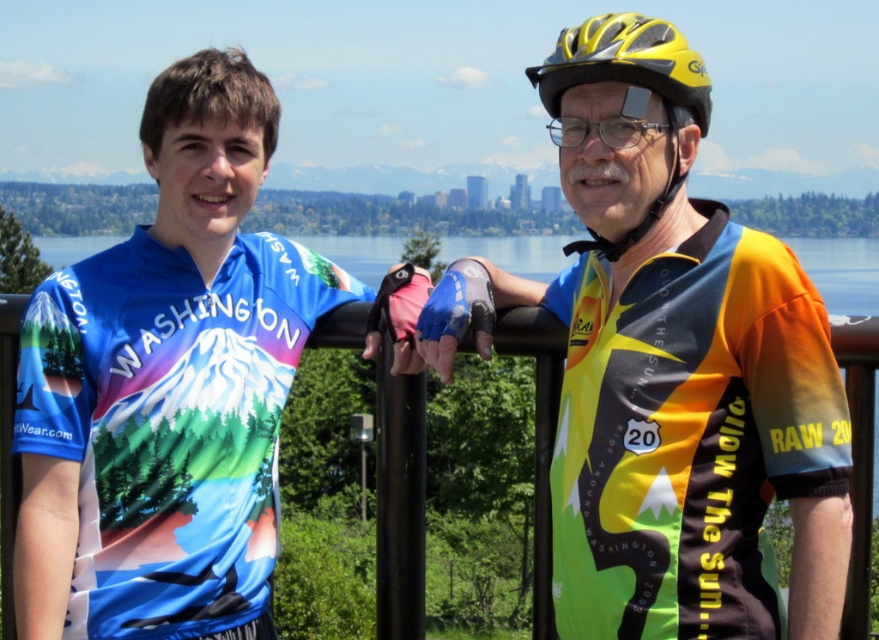
Is neon yellow jersey at center closer to camera compared to transparent plastic goggles at upper center?

Yes, neon yellow jersey at center is closer to the viewer.

Does neon yellow jersey at center appear on the right side of transparent plastic goggles at upper center?

In fact, neon yellow jersey at center is to the left of transparent plastic goggles at upper center.

Locate an element on the screen. neon yellow jersey at center is located at coordinates (672, 372).

Can you confirm if neon yellow jersey at center is smaller than yellow matte bicycle helmet at upper center?

Indeed, neon yellow jersey at center has a smaller size compared to yellow matte bicycle helmet at upper center.

Can you confirm if neon yellow jersey at center is bigger than yellow matte bicycle helmet at upper center?

No.

Who is more distant from viewer, (x=781, y=273) or (x=563, y=67)?

Point (x=563, y=67)

You are a GUI agent. You are given a task and a screenshot of the screen. Output one action in this format:
    pyautogui.click(x=<x>, y=<y>)
    Task: Click on the neon yellow jersey at center
    The image size is (879, 640).
    Given the screenshot: What is the action you would take?
    coord(672,372)

Is blue jersey at left wider than transparent plastic goggles at upper center?

Indeed, blue jersey at left has a greater width compared to transparent plastic goggles at upper center.

The height and width of the screenshot is (640, 879). Describe the element at coordinates (166, 387) in the screenshot. I see `blue jersey at left` at that location.

Where is `blue jersey at left`? blue jersey at left is located at coordinates (166, 387).